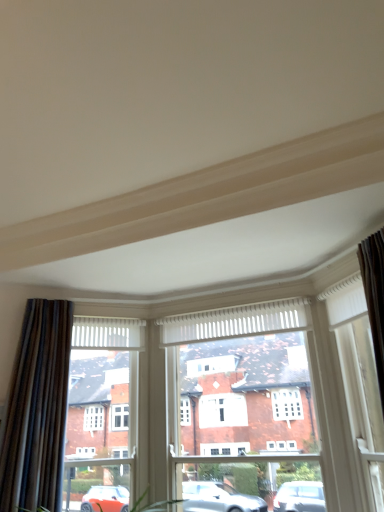
What do you see at coordinates (37, 410) in the screenshot? I see `dark brown textured curtain at left` at bounding box center [37, 410].

This screenshot has height=512, width=384. I want to click on white wood frame at right, so click(359, 386).

In order to face white wood frame at right, should I rotate leftwards or rightwards?

You should rotate right by 22.948 degrees.

This screenshot has width=384, height=512. I want to click on dark brown textured curtain at left, so click(x=37, y=410).

How many degrees apart are the facing directions of white wood frame at right and dark brown textured curtain at left?

The angle between the facing direction of white wood frame at right and the facing direction of dark brown textured curtain at left is 94.1 degrees.

Locate an element on the screen. This screenshot has height=512, width=384. curtain lying below the white wood frame at right (from the image's perspective) is located at coordinates (37, 410).

In the scene shown: Is white wood frame at right not close to dark brown textured curtain at left?

white wood frame at right is far away from dark brown textured curtain at left.

Is white wood frame at right looking in the opposite direction of dark brown textured curtain at left?

No, white wood frame at right's orientation is not away from dark brown textured curtain at left.

Between dark brown textured curtain at left and white wood frame at right, which one has smaller width?

With smaller width is white wood frame at right.

Is dark brown textured curtain at left located outside white wood frame at right?

dark brown textured curtain at left lies outside white wood frame at right's area.

Is dark brown textured curtain at left behind white wood frame at right?

Yes, it is.

From the image's perspective, which one is positioned lower, dark brown textured curtain at left or white wood frame at right?

From the image's view, dark brown textured curtain at left is below.

From the image's perspective, is white wood window frame at center above dark brown textured curtain at left?

Actually, white wood window frame at center appears below dark brown textured curtain at left in the image.

What's the angular difference between white wood window frame at center and dark brown textured curtain at left's facing directions?

43.7 degrees separate the facing orientations of white wood window frame at center and dark brown textured curtain at left.

Between white wood window frame at center and dark brown textured curtain at left, which one has smaller width?

With smaller width is white wood window frame at center.

Identify the location of curtain on the left of the white wood window frame at center. This screenshot has height=512, width=384. (37, 410).

Is point (41, 444) closer or farther from the camera than point (196, 324)?

Clearly, point (41, 444) is closer to the camera than point (196, 324).

What are the coordinates of `window frame that appears on the right of dark brown textured curtain at left` in the screenshot? It's located at (244, 380).

Does dark brown textured curtain at left have a lesser width compared to white wood window frame at center?

No.

Can you tell me how much dark brown textured curtain at left and white wood window frame at center differ in facing direction?

The angular difference between dark brown textured curtain at left and white wood window frame at center is 43.7 degrees.

From the image's perspective, which is above, white wood frame at right or white wood window frame at center?

From the image's view, white wood frame at right is above.

Could you tell me if white wood frame at right is facing white wood window frame at center?

No, white wood frame at right is not turned towards white wood window frame at center.

Between white wood frame at right and white wood window frame at center, which one has smaller width?

white wood frame at right is thinner.

Is white wood frame at right far from white wood window frame at center?

No, there isn't a large distance between white wood frame at right and white wood window frame at center.

Which is behind, white wood window frame at center or white wood frame at right?

Positioned behind is white wood window frame at center.

Can you tell me how much white wood window frame at center and white wood frame at right differ in facing direction?

50.4 degrees.

Is white wood window frame at center to the left of white wood frame at right from the viewer's perspective?

Indeed, white wood window frame at center is positioned on the left side of white wood frame at right.

Considering the sizes of white wood window frame at center and white wood frame at right in the image, is white wood window frame at center wider or thinner than white wood frame at right?

In the image, white wood window frame at center appears to be wider than white wood frame at right.

Where is `curtain below the white wood frame at right (from the image's perspective)`? The height and width of the screenshot is (512, 384). curtain below the white wood frame at right (from the image's perspective) is located at coordinates (37, 410).

The image size is (384, 512). I want to click on window beneath the dark brown textured curtain at left (from a real-world perspective), so click(x=359, y=386).

Considering their positions, is white wood window frame at center positioned closer to white wood frame at right than dark brown textured curtain at left?

Among the two, white wood window frame at center is located nearer to white wood frame at right.

Based on their spatial positions, is dark brown textured curtain at left or white wood window frame at center closer to white wood frame at right?

Among the two, white wood window frame at center is located nearer to white wood frame at right.

From the image, which object appears to be nearer to dark brown textured curtain at left, white wood frame at right or white wood window frame at center?

white wood window frame at center is positioned closer to the anchor dark brown textured curtain at left.

Looking at the image, which one is located closer to dark brown textured curtain at left, white wood window frame at center or white wood frame at right?

The object closer to dark brown textured curtain at left is white wood window frame at center.

Which object lies nearer to the anchor point white wood window frame at center, white wood frame at right or dark brown textured curtain at left?

white wood frame at right lies closer to white wood window frame at center than the other object.

Looking at the image, which one is located further to white wood window frame at center, dark brown textured curtain at left or white wood frame at right?

Based on the image, dark brown textured curtain at left appears to be further to white wood window frame at center.

Locate an element on the screen. The image size is (384, 512). window frame between dark brown textured curtain at left and white wood frame at right from left to right is located at coordinates (244, 380).